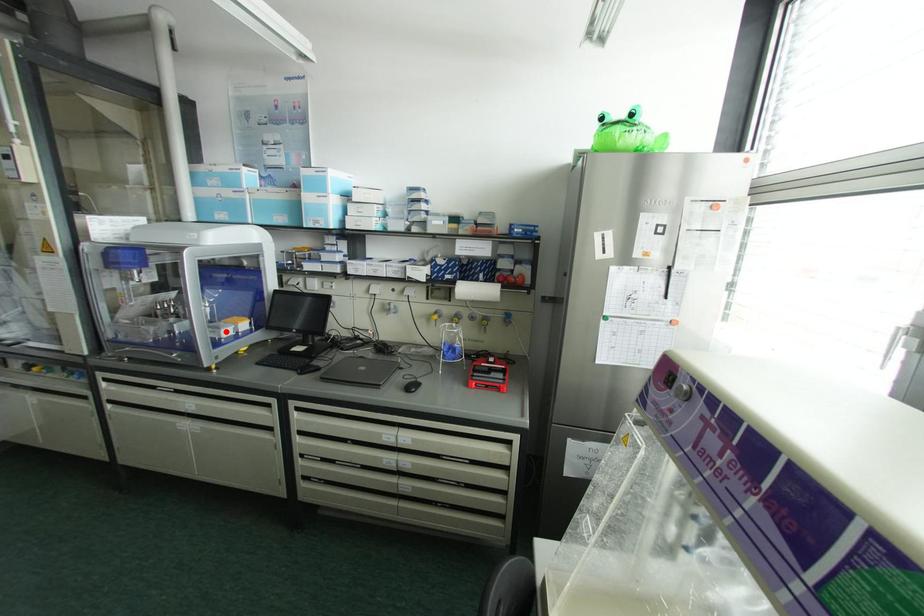
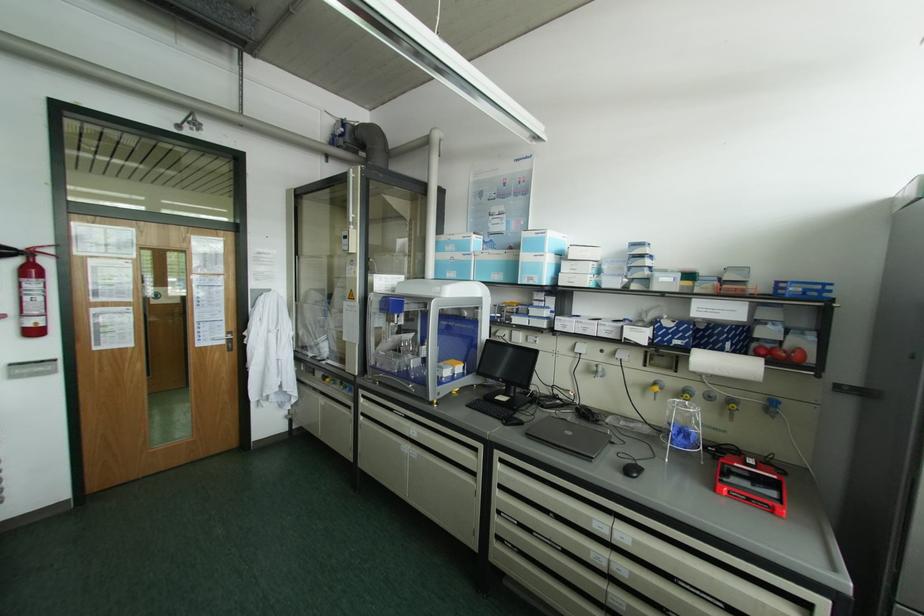
Locate, in the second image, the point that corresponds to the highlighted location in the first image.

(445, 371)